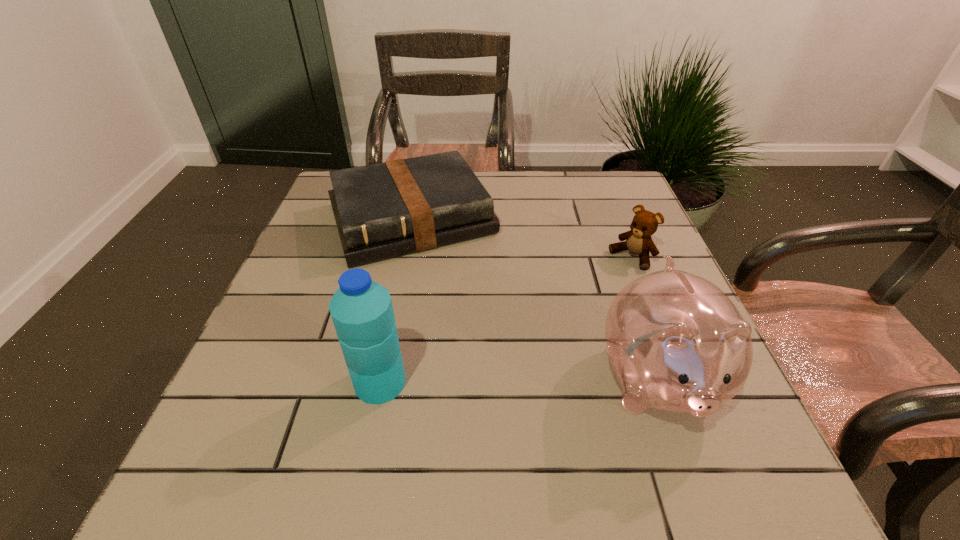
This screenshot has height=540, width=960. Identify the location of vacant region at the near edge of the desktop. (385, 423).

The height and width of the screenshot is (540, 960). In order to click on vacant space at the left edge of the desktop in this screenshot , I will do `click(311, 294)`.

In the image, there is a desktop. What are the coordinates of `free space at the right edge` in the screenshot? It's located at (633, 269).

Locate an element on the screen. The height and width of the screenshot is (540, 960). free space at the near right corner of the desktop is located at coordinates (736, 426).

Where is `vacant space that's between the hardback book and the second shortest object`? vacant space that's between the hardback book and the second shortest object is located at coordinates (521, 238).

This screenshot has height=540, width=960. I want to click on vacant region between the piggy bank and the shortest object, so click(x=535, y=301).

The image size is (960, 540). In order to click on vacant space that's between the hardback book and the teddy bear in this screenshot , I will do `click(521, 238)`.

In order to click on empty location between the piggy bank and the water bottle in this screenshot , I will do click(x=518, y=382).

Locate an element on the screen. vacant space that is in between the second shortest object and the shortest object is located at coordinates pos(521,238).

The height and width of the screenshot is (540, 960). I want to click on vacant region between the shortest object and the piggy bank, so 535,301.